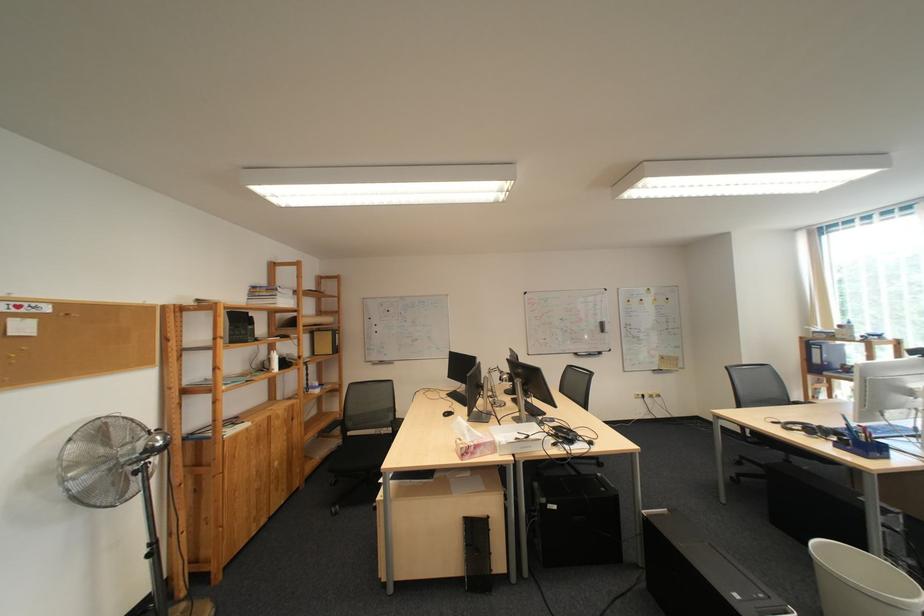
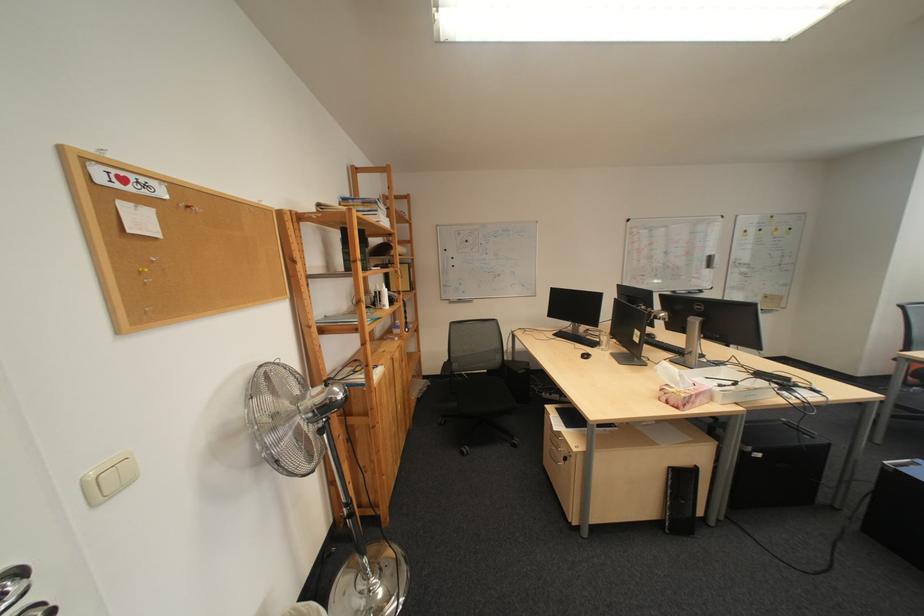
Find the pixel in the second image that matches [479,438] in the first image.

(690, 385)